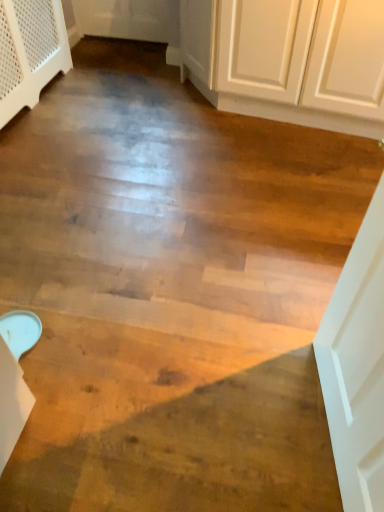
Where is `free area in between white matte door at right and white textured dresser at upper left`? free area in between white matte door at right and white textured dresser at upper left is located at coordinates (138, 210).